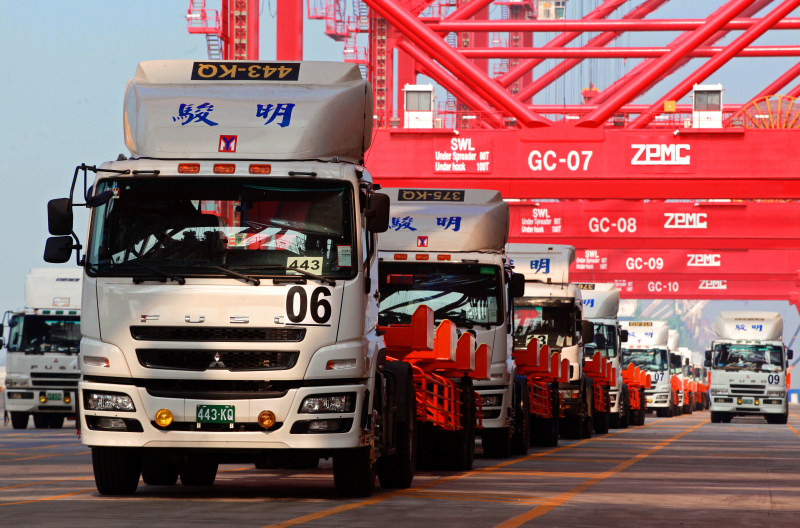
In order to click on metal stairs in this screenshot , I will do `click(210, 44)`, `click(200, 13)`, `click(348, 37)`.